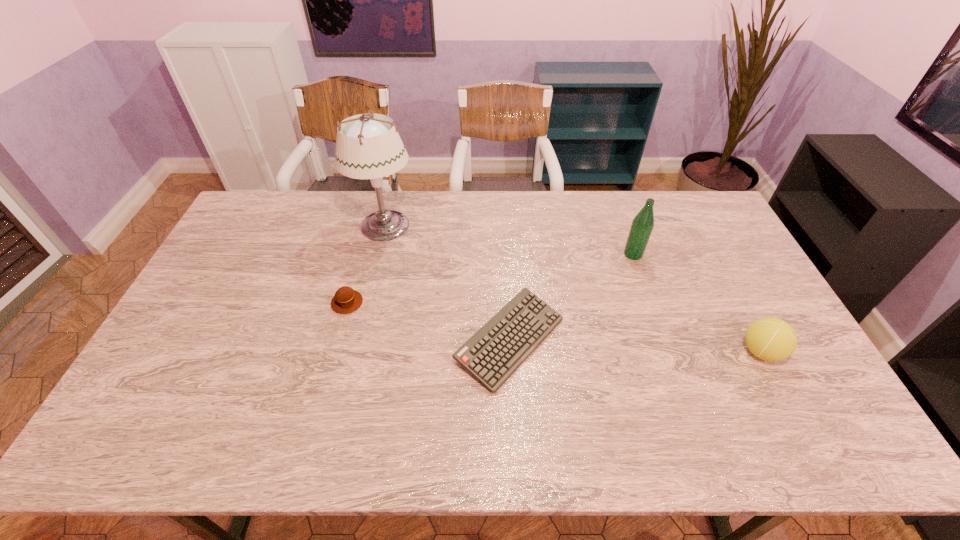
At what (x,y) coordinates should I click in order to perform the action: click on free spot located on the back of the third shortest object. Please return your answer as a coordinate pair (x, y). Looking at the image, I should click on (724, 281).

You are a GUI agent. You are given a task and a screenshot of the screen. Output one action in this format:
    pyautogui.click(x=<x>, y=<y>)
    Task: Click on the free space located on the front of the muffin
    This screenshot has height=540, width=960.
    Given the screenshot: What is the action you would take?
    pyautogui.click(x=337, y=340)

Identify the location of vacant area situated on the right of the shortest object. Image resolution: width=960 pixels, height=540 pixels. (652, 341).

Locate an element on the screen. The width and height of the screenshot is (960, 540). object at the far edge is located at coordinates (370, 148).

At what (x,y) coordinates should I click in order to perform the action: click on object at the right edge. Please return your answer as a coordinate pair (x, y). This screenshot has width=960, height=540. Looking at the image, I should click on (771, 339).

The width and height of the screenshot is (960, 540). I want to click on free region at the far edge of the desktop, so click(x=483, y=206).

At what (x,y) coordinates should I click in order to perform the action: click on vacant space at the near edge of the desktop. Please return your answer as a coordinate pair (x, y). This screenshot has height=540, width=960. Looking at the image, I should click on (373, 429).

In the image, there is a desktop. Where is `vacant space at the right edge`? This screenshot has height=540, width=960. vacant space at the right edge is located at coordinates (727, 299).

The height and width of the screenshot is (540, 960). In the image, there is a desktop. In order to click on vacant region at the far left corner in this screenshot , I will do `click(276, 228)`.

Where is `vacant area that lies between the fourth object from left to right and the shortest object`? The height and width of the screenshot is (540, 960). vacant area that lies between the fourth object from left to right and the shortest object is located at coordinates (571, 298).